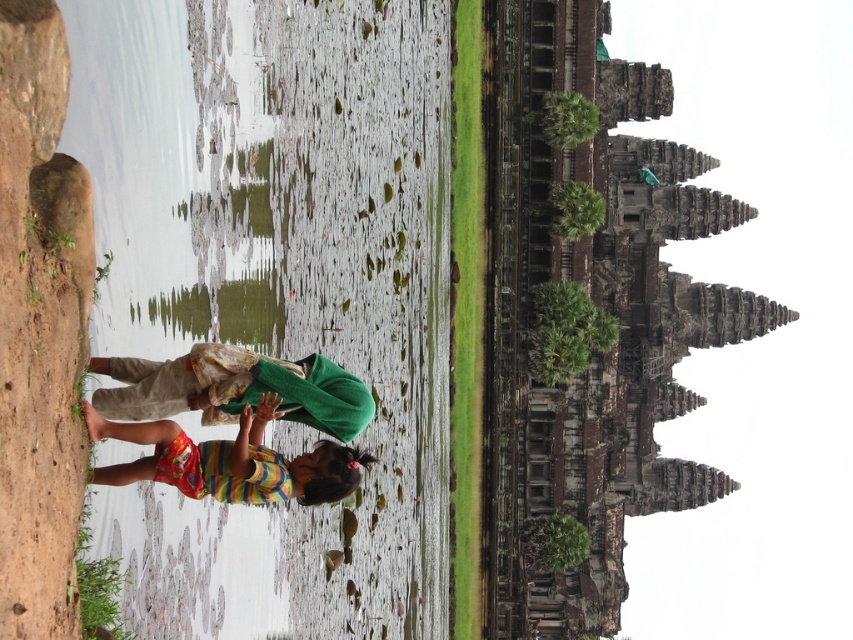
Does brown rough rock at left appear under multicolored striped shirt at center?

Incorrect, brown rough rock at left is not positioned below multicolored striped shirt at center.

Which is more to the left, brown rough rock at left or multicolored striped shirt at center?

Positioned to the left is brown rough rock at left.

At what (x,y) coordinates should I click in order to perform the action: click on brown rough rock at left. Please return your answer as a coordinate pair (x, y). The image size is (853, 640). Looking at the image, I should click on (39, 326).

Looking at this image, which is below, brown rough rock at left or green fabric at center?

Positioned lower is green fabric at center.

Does brown rough rock at left appear under green fabric at center?

No.

Measure the distance between point (x=76, y=244) and camera.

The distance of point (x=76, y=244) from camera is 48.05 meters.

In order to click on brown rough rock at left in this screenshot , I will do `click(39, 326)`.

Is point (552, 500) positioned behind point (64, 598)?

Yes, point (552, 500) is behind point (64, 598).

Does rusty stone temple at upper right have a greater height compared to brown rough rock at left?

Yes.

Is point (619, 148) in front of point (62, 620)?

No, (619, 148) is behind (62, 620).

Find the location of a particular element. rusty stone temple at upper right is located at coordinates 601,307.